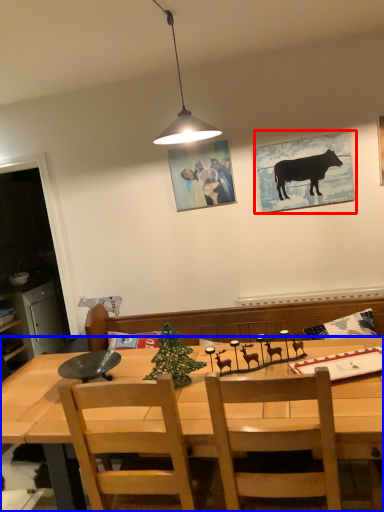
Question: Which object is closer to the camera taking this photo, picture frame (highlighted by a red box) or desk (highlighted by a blue box)?

Choices:
 (A) picture frame
 (B) desk

Answer: (B)